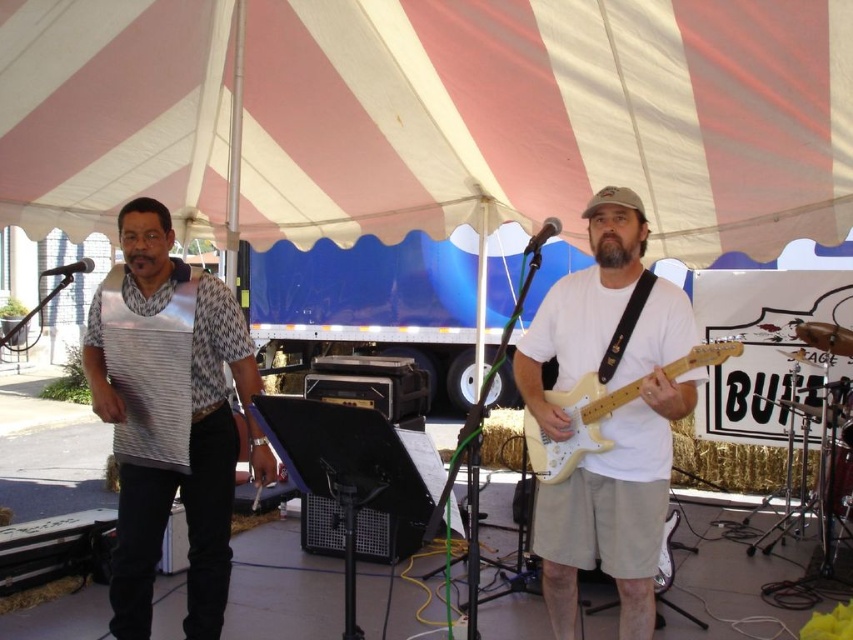
You are standing at the camera position and want to take a photo of the electric guitar player. The camera has a focal length of 50mm and a sensor size of 24mm x 36mm. If the electric guitar player is at point (90, 387), which is 5.28 meters away from the camera, what is the angle of view required to capture the entire electric guitar player in the frame?

The angle of view required to capture the entire electric guitar player at point (90, 387), which is 5.28 meters away from the camera, can be calculated using the sensor size and focal length. The formula for angle of view is 2 times arctangent of sensor dimension divided by 2 times focal length. Using the 36mm width for horizontal angle of view, the calculation would be 2 arctan 36mm divided by 2 times 50mm. This results in approximately 46.6 degrees. However, since the exact position and size of the e

You are a photographer standing at the front of the stage. You want to capture a photo of the white matte electric guitar at center. Where should you position yourself to ensure the guitar is centered in your shot?

To center the white matte electric guitar at center in your photo, position yourself directly in front of the guitar at point [575,426].